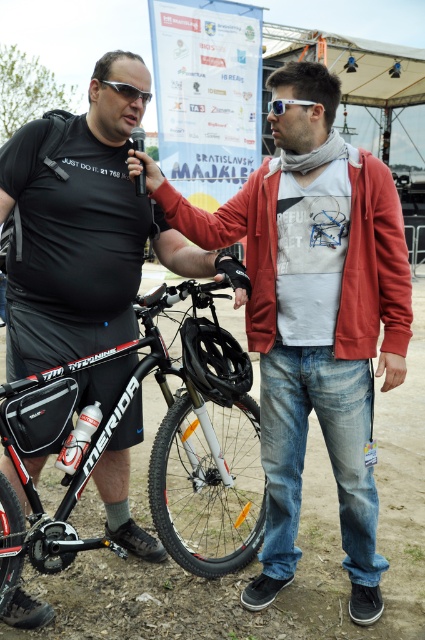
Does black matte bicycle at center have a larger size compared to matte black sunglasses at upper left?

Yes, black matte bicycle at center is bigger than matte black sunglasses at upper left.

Locate an element on the screen. The image size is (425, 640). black matte bicycle at center is located at coordinates (150, 456).

How much distance is there between matte black sunglasses at upper left and transparent plastic goggles at upper center?

The distance of matte black sunglasses at upper left from transparent plastic goggles at upper center is 6.46 meters.

Does matte black sunglasses at upper left have a greater width compared to transparent plastic goggles at upper center?

Incorrect, matte black sunglasses at upper left's width does not surpass transparent plastic goggles at upper center's.

Identify the location of matte black sunglasses at upper left. (127, 90).

Where is `matte black sunglasses at upper left`? The height and width of the screenshot is (640, 425). matte black sunglasses at upper left is located at coordinates (127, 90).

Measure the distance between black matte bicycle at center and camera.

black matte bicycle at center and camera are 9.37 feet apart.

Does black matte bicycle at center have a greater height compared to transparent plastic goggles at upper center?

No.

Where is `black matte bicycle at center`? This screenshot has width=425, height=640. black matte bicycle at center is located at coordinates tap(150, 456).